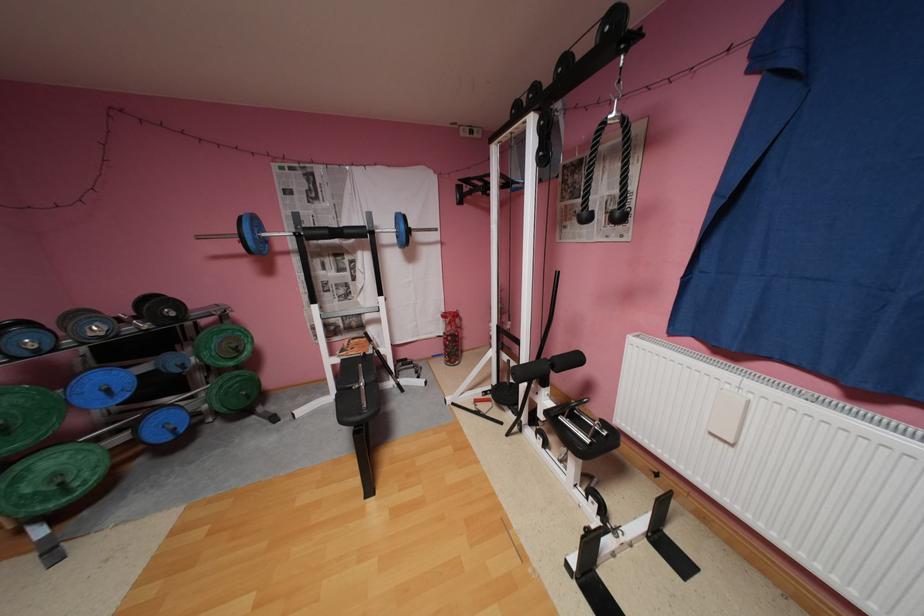
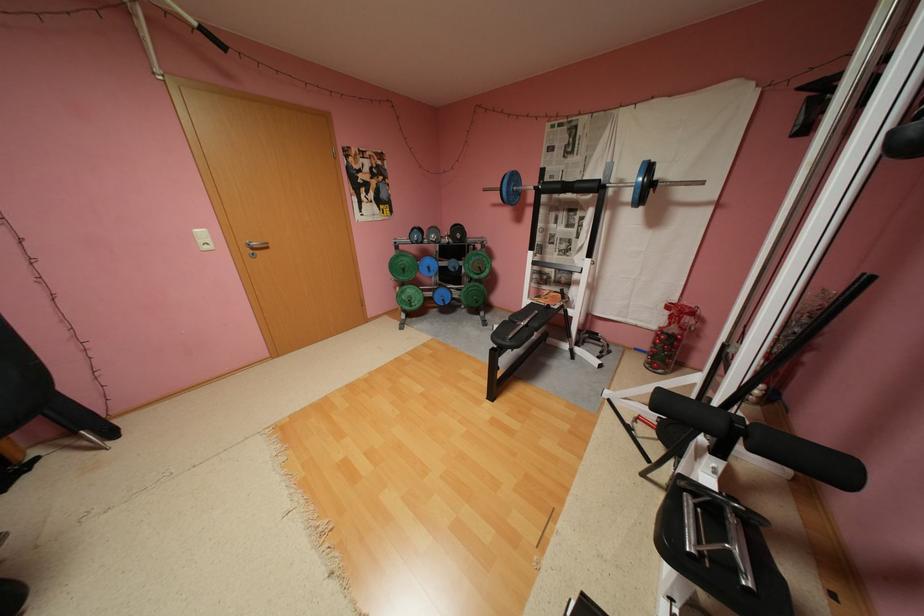
In the second image, find the point that corresponds to [130,438] in the first image.

(439, 294)